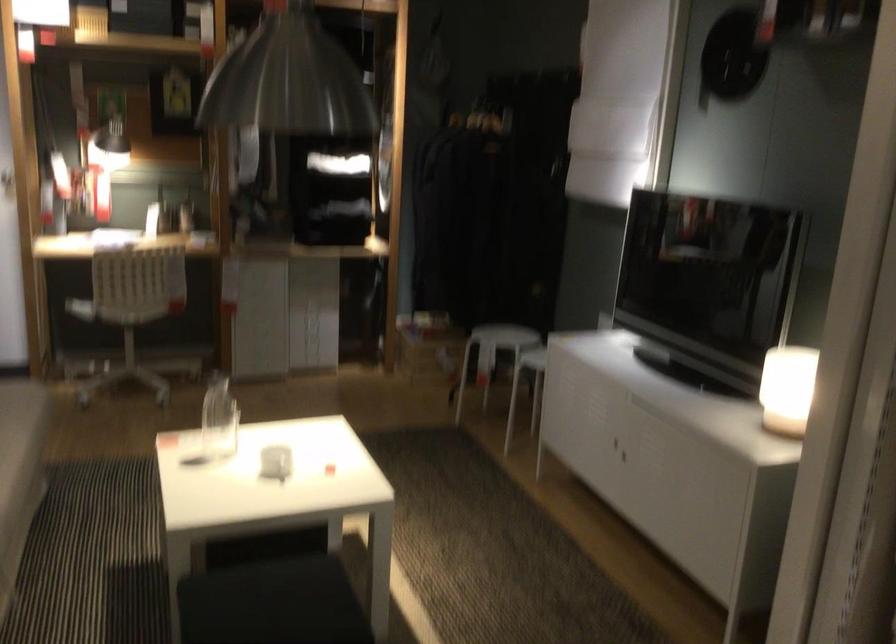
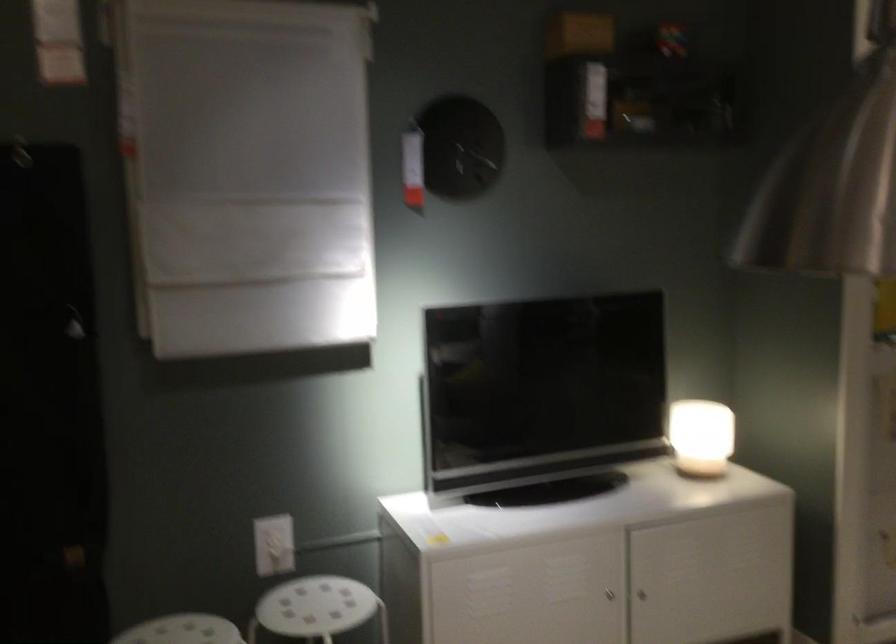
In the second image, find the point that corresponds to [531,332] in the first image.

(182, 630)